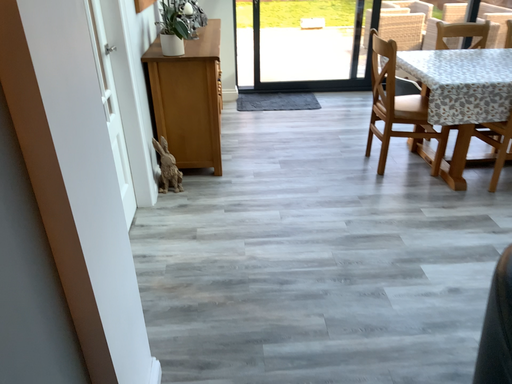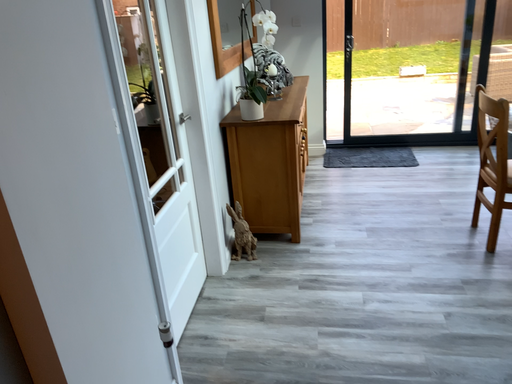
Question: How did the camera likely rotate when shooting the video?

Choices:
 (A) rotated right
 (B) rotated left

Answer: (B)